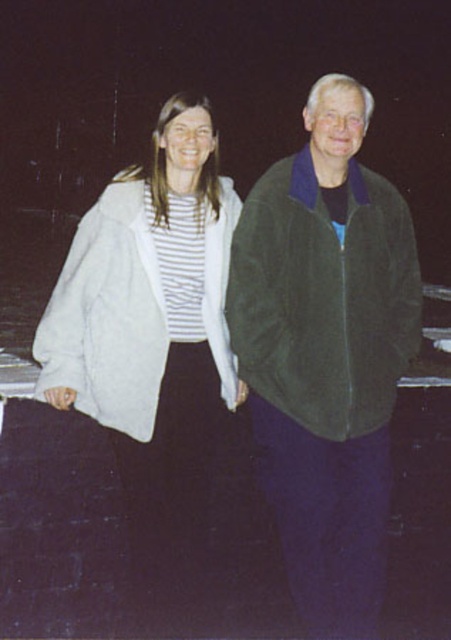
Question: Which object appears closest to the camera in this image?

Choices:
 (A) white fuzzy jacket at center
 (B) dark green suede jacket at right

Answer: (A)

Question: Is dark green suede jacket at right thinner than white fuzzy jacket at center?

Choices:
 (A) yes
 (B) no

Answer: (A)

Question: Which point appears closest to the camera in this image?

Choices:
 (A) (169, 493)
 (B) (299, 259)

Answer: (B)

Question: Observing the image, what is the correct spatial positioning of dark green suede jacket at right in reference to white fuzzy jacket at center?

Choices:
 (A) above
 (B) below

Answer: (A)

Question: Which point appears farthest from the camera in this image?

Choices:
 (A) [x=249, y=269]
 (B) [x=211, y=369]

Answer: (B)

Question: Is dark green suede jacket at right bigger than white fuzzy jacket at center?

Choices:
 (A) yes
 (B) no

Answer: (A)